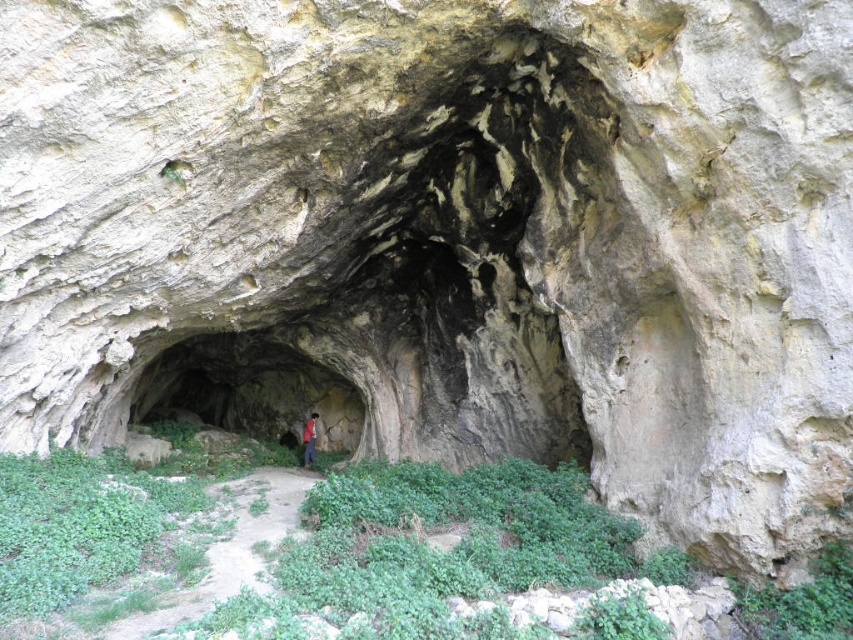
You are standing at the entrance of the cave and see the green mossy cave at center and the red fabric person at center. Which object is positioned to the right of the other?

The green mossy cave at center is to the right of the red fabric person at center.

You are a hiker standing at the cave entrance. If you want to take a photo of the green mossy cave at center, where should you position yourself relative to the cave entrance?

The green mossy cave at center is located at point (248, 390), so you should position yourself slightly to the right and above the cave entrance to capture it in the frame.

You are standing at point A, which is at coordinates point A at (230, 422). You want to walk to point B, which is 18.26 meters away. Is the path between these two points wide enough for a person to walk comfortably?

The path between point A at (230, 422) and point B is 18.26 meters long. The width of the path is not specified, so it is impossible to determine if it is wide enough for a person to walk comfortably based on the given information.